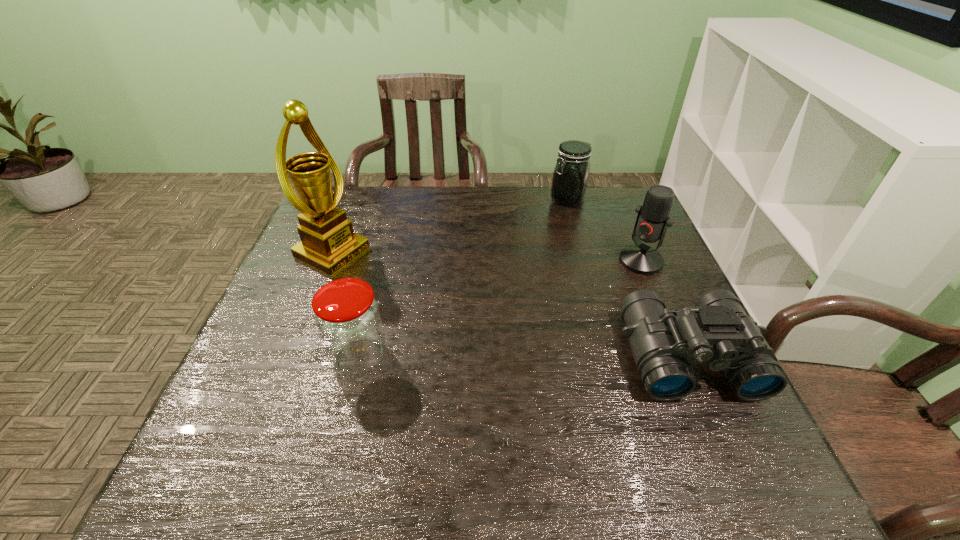
Identify the location of free space on the desktop that is between the nearer jar and the binoculars and is positioned on the lid of the farther jar. (486, 356).

Find the location of a particular element. Image resolution: width=960 pixels, height=540 pixels. vacant space on the desktop that is between the left jar and the binoculars and is positioned on the front-facing side of the tallest object is located at coordinates point(547,356).

Identify the location of vacant space on the desktop that is between the left jar and the binoculars and is positioned on the side of the second tallest object with the red ring. (532, 356).